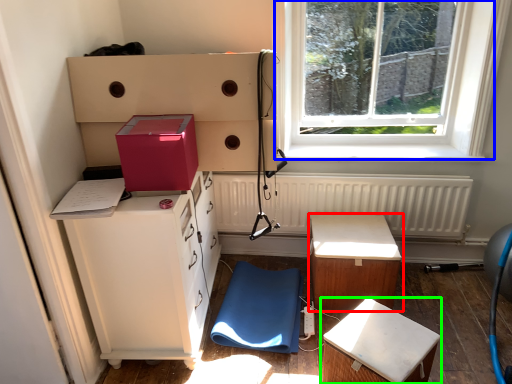
Question: Which object is positioned farthest from table (highlighted by a red box)? Select from window (highlighted by a blue box) and furniture (highlighted by a green box).

Choices:
 (A) window
 (B) furniture

Answer: (A)